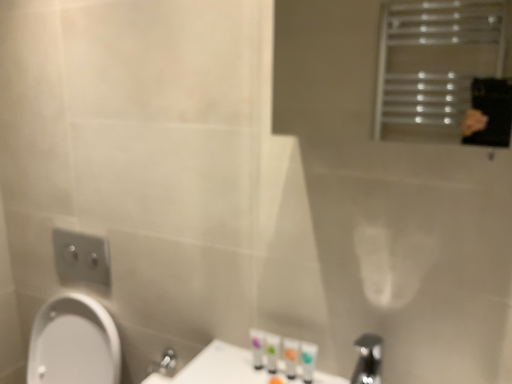
Question: In the image, is translucent plastic bottles at lower center, which is the first toiletry in left-to-right order, on the left side or the right side of translucent plastic tubes at lower center, the second toiletry positioned from the right?

Choices:
 (A) left
 (B) right

Answer: (A)

Question: From a real-world perspective, is translucent plastic bottles at lower center, which is the first toiletry in left-to-right order, physically located above or below translucent plastic tubes at lower center, acting as the 3th toiletry starting from the left?

Choices:
 (A) above
 (B) below

Answer: (B)

Question: Which object is the closest to the silver metallic tap at lower right?

Choices:
 (A) translucent plastic bottles at lower center, acting as the 4th toiletry starting from the right
 (B) metallic silver towel rack at upper right
 (C) translucent plastic tubes at lower center, acting as the 3th toiletry starting from the left
 (D) white glossy tube at lower center, the first toiletry viewed from the right
 (E) translucent plastic tubes at lower center, the 2th toiletry in the left-to-right sequence

Answer: (D)

Question: Which of these objects is positioned closest to the silver metallic tap at lower right?

Choices:
 (A) white glossy tube at lower center, the first toiletry viewed from the right
 (B) metallic silver towel rack at upper right
 (C) translucent plastic tubes at lower center, the second toiletry positioned from the right
 (D) translucent plastic tubes at lower center, the 2th toiletry in the left-to-right sequence
 (E) translucent plastic bottles at lower center, which is the first toiletry in left-to-right order

Answer: (A)